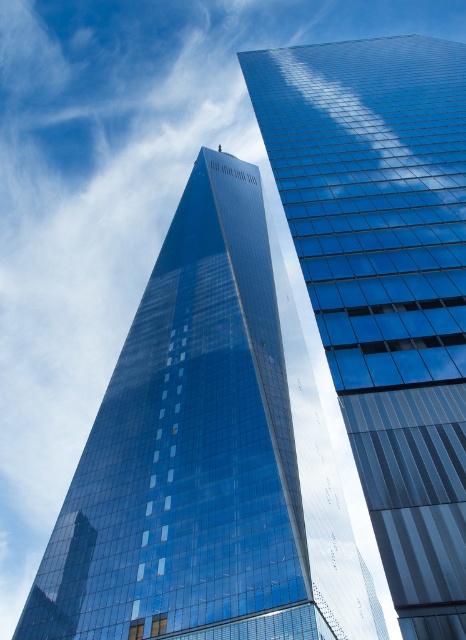
Question: Does glossy glass tower at center appear under glossy glass skyscraper at center?

Choices:
 (A) yes
 (B) no

Answer: (A)

Question: Which point is closer to the camera?

Choices:
 (A) (436, 273)
 (B) (224, 605)

Answer: (A)

Question: Is glossy glass tower at center wider than glossy glass skyscraper at center?

Choices:
 (A) yes
 (B) no

Answer: (A)

Question: In this image, where is glossy glass tower at center located relative to glossy glass skyscraper at center?

Choices:
 (A) below
 (B) above

Answer: (A)